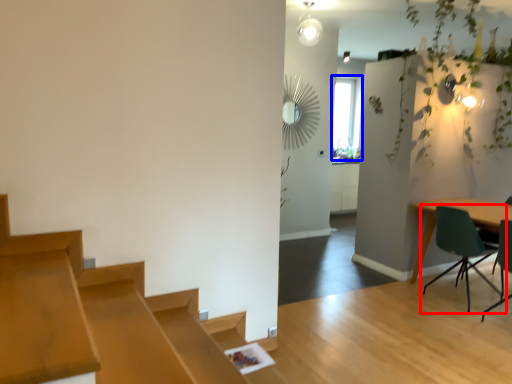
Question: Which object appears farthest to the camera in this image, chair (highlighted by a red box) or window (highlighted by a blue box)?

Choices:
 (A) chair
 (B) window

Answer: (B)